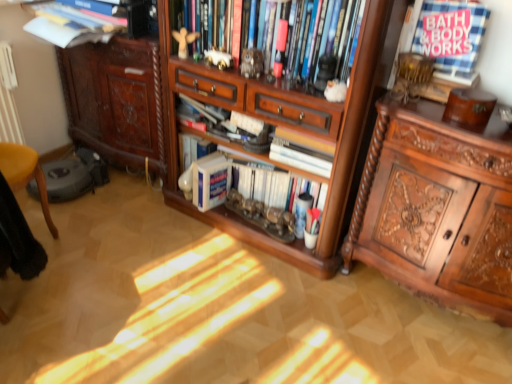
Where is `blank area beneath polished wood cabinet at right, the 1th cabinetry positioned from the right (from a real-world perspective)`? This screenshot has height=384, width=512. blank area beneath polished wood cabinet at right, the 1th cabinetry positioned from the right (from a real-world perspective) is located at coordinates (426, 307).